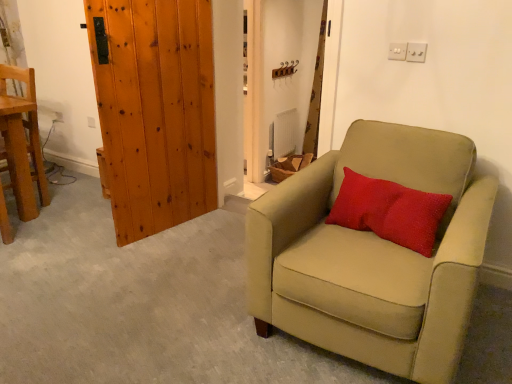
Question: Considering the relative sizes of suede beige armchair at right, which is the first chair in right-to-left order, and white plastic electric outlet at lower left in the image provided, is suede beige armchair at right, which is the first chair in right-to-left order, bigger than white plastic electric outlet at lower left?

Choices:
 (A) yes
 (B) no

Answer: (A)

Question: Does suede beige armchair at right, which is the first chair in right-to-left order, turn towards white plastic electric outlet at lower left?

Choices:
 (A) yes
 (B) no

Answer: (B)

Question: Can you confirm if suede beige armchair at right, which is the first chair in right-to-left order, is smaller than white plastic electric outlet at lower left?

Choices:
 (A) yes
 (B) no

Answer: (B)

Question: From a real-world perspective, is suede beige armchair at right, positioned as the second chair in left-to-right order, beneath white plastic electric outlet at lower left?

Choices:
 (A) yes
 (B) no

Answer: (A)

Question: Is suede beige armchair at right, which is the first chair in right-to-left order, taller than white plastic electric outlet at lower left?

Choices:
 (A) yes
 (B) no

Answer: (A)

Question: Considering the relative positions of suede beige armchair at right, which is the first chair in right-to-left order, and white plastic electric outlet at lower left in the image provided, is suede beige armchair at right, which is the first chair in right-to-left order, to the right of white plastic electric outlet at lower left from the viewer's perspective?

Choices:
 (A) yes
 (B) no

Answer: (A)

Question: Is wooden plank door at left completely or partially inside matte brown curtain at upper center?

Choices:
 (A) yes
 (B) no

Answer: (B)

Question: Is matte brown curtain at upper center aimed at wooden plank door at left?

Choices:
 (A) yes
 (B) no

Answer: (A)

Question: Is matte brown curtain at upper center positioned before wooden plank door at left?

Choices:
 (A) yes
 (B) no

Answer: (B)

Question: Is matte brown curtain at upper center at the right side of wooden plank door at left?

Choices:
 (A) yes
 (B) no

Answer: (A)

Question: Is matte brown curtain at upper center taller than wooden plank door at left?

Choices:
 (A) no
 (B) yes

Answer: (B)

Question: Is matte brown curtain at upper center thinner than wooden plank door at left?

Choices:
 (A) no
 (B) yes

Answer: (A)

Question: Is red textured pillow at center positioned in front of matte brown curtain at upper center?

Choices:
 (A) yes
 (B) no

Answer: (A)